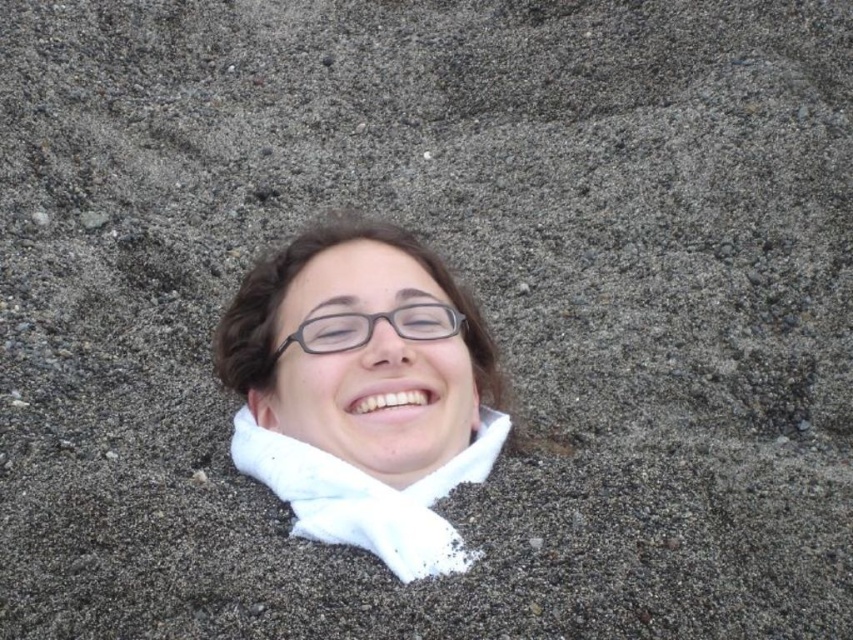
Question: Among these points, which one is farthest from the camera?

Choices:
 (A) [x=412, y=337]
 (B) [x=345, y=236]

Answer: (B)

Question: Does white matte scarf at center have a lesser width compared to matte black glasses at center?

Choices:
 (A) no
 (B) yes

Answer: (A)

Question: Is white matte scarf at center bigger than matte black glasses at center?

Choices:
 (A) no
 (B) yes

Answer: (B)

Question: From the image, what is the correct spatial relationship of white matte scarf at center in relation to matte black glasses at center?

Choices:
 (A) right
 (B) left

Answer: (A)